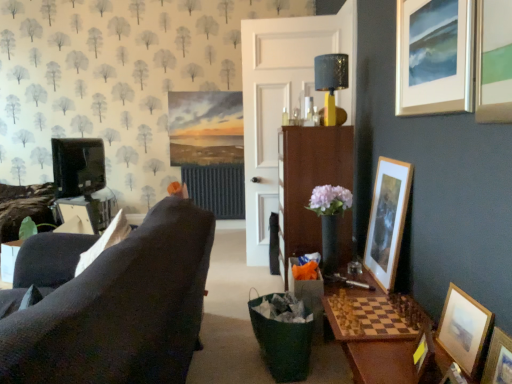
Question: Should I look upward or downward to see wooden picture frame at lower right, placed as the sixth picture frame when sorted from top to bottom?

Choices:
 (A) down
 (B) up

Answer: (A)

Question: Is wooden picture frame at lower right, the 3th picture frame when ordered from bottom to top, facing away from silver metallic picture frame at upper right, arranged as the 6th picture frame when ordered from the bottom?

Choices:
 (A) no
 (B) yes

Answer: (A)

Question: Is wooden picture frame at lower right, the 3th picture frame when ordered from bottom to top, beside silver metallic picture frame at upper right, placed as the 1th picture frame when sorted from top to bottom?

Choices:
 (A) no
 (B) yes

Answer: (A)

Question: From a real-world perspective, is wooden picture frame at lower right, the 3th picture frame when ordered from bottom to top, positioned under silver metallic picture frame at upper right, arranged as the 6th picture frame when ordered from the bottom, based on gravity?

Choices:
 (A) no
 (B) yes

Answer: (B)

Question: Can you confirm if wooden picture frame at lower right, the 3th picture frame when ordered from bottom to top, is positioned to the left of silver metallic picture frame at upper right, arranged as the 6th picture frame when ordered from the bottom?

Choices:
 (A) no
 (B) yes

Answer: (B)

Question: Is wooden picture frame at lower right, placed as the 4th picture frame when sorted from top to bottom, smaller than silver metallic picture frame at upper right, arranged as the 6th picture frame when ordered from the bottom?

Choices:
 (A) no
 (B) yes

Answer: (B)

Question: Can you confirm if wooden picture frame at lower right, the 3th picture frame when ordered from bottom to top, is thinner than silver metallic picture frame at upper right, placed as the 1th picture frame when sorted from top to bottom?

Choices:
 (A) no
 (B) yes

Answer: (A)

Question: From the image's perspective, is shiny metallic lampshade at upper center beneath silver metallic picture frame at upper right, placed as the 1th picture frame when sorted from top to bottom?

Choices:
 (A) no
 (B) yes

Answer: (A)

Question: Is shiny metallic lampshade at upper center positioned with its back to silver metallic picture frame at upper right, placed as the 1th picture frame when sorted from top to bottom?

Choices:
 (A) yes
 (B) no

Answer: (B)

Question: Considering the relative positions of shiny metallic lampshade at upper center and silver metallic picture frame at upper right, arranged as the 6th picture frame when ordered from the bottom, in the image provided, is shiny metallic lampshade at upper center to the right of silver metallic picture frame at upper right, arranged as the 6th picture frame when ordered from the bottom, from the viewer's perspective?

Choices:
 (A) yes
 (B) no

Answer: (B)

Question: Is shiny metallic lampshade at upper center thinner than silver metallic picture frame at upper right, placed as the 1th picture frame when sorted from top to bottom?

Choices:
 (A) yes
 (B) no

Answer: (B)

Question: Is shiny metallic lampshade at upper center smaller than silver metallic picture frame at upper right, arranged as the 6th picture frame when ordered from the bottom?

Choices:
 (A) no
 (B) yes

Answer: (A)

Question: From a real-world perspective, does shiny metallic lampshade at upper center stand above silver metallic picture frame at upper right, placed as the 1th picture frame when sorted from top to bottom?

Choices:
 (A) yes
 (B) no

Answer: (B)

Question: Is wooden picture frame at lower right, arranged as the 5th picture frame when viewed from the top, outside white wooden door at center?

Choices:
 (A) no
 (B) yes

Answer: (B)